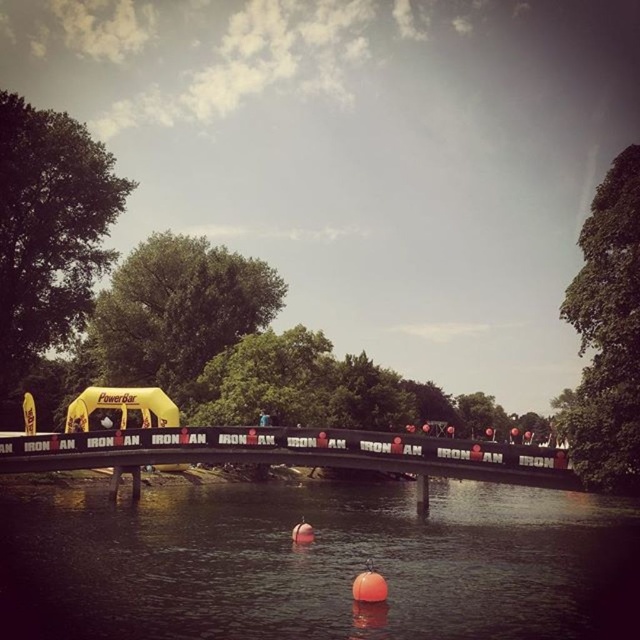
Question: Which point is farther to the camera?

Choices:
 (A) black fabric tent at center
 (B) transparent plastic buoys at lower center
 (C) black metal bridge at center

Answer: (C)

Question: Is black fabric tent at center smaller than black metal bridge at center?

Choices:
 (A) no
 (B) yes

Answer: (A)

Question: Is the position of transparent plastic buoys at lower center more distant than that of black metal bridge at center?

Choices:
 (A) yes
 (B) no

Answer: (B)

Question: Which object is positioned farthest from the black metal bridge at center?

Choices:
 (A) black fabric tent at center
 (B) transparent plastic buoys at lower center

Answer: (A)

Question: Can you confirm if transparent plastic buoys at lower center is positioned below black metal bridge at center?

Choices:
 (A) no
 (B) yes

Answer: (B)

Question: Among these objects, which one is nearest to the camera?

Choices:
 (A) black metal bridge at center
 (B) black fabric tent at center

Answer: (B)